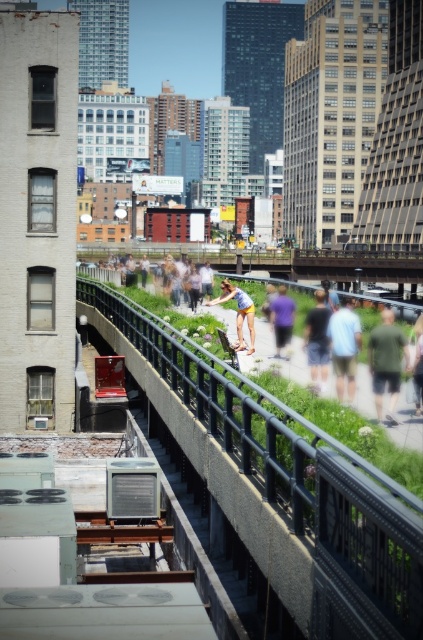
Question: Is green matte shirt at center thinner than dark gray shorts at center?

Choices:
 (A) yes
 (B) no

Answer: (A)

Question: Is green matte shirt at center below matte yellow shorts at center?

Choices:
 (A) yes
 (B) no

Answer: (A)

Question: Which object is the farthest from the purple cotton shirt at center?

Choices:
 (A) matte yellow shorts at center
 (B) matte white shorts at center
 (C) green grass at center

Answer: (C)

Question: Which object is closer to the camera taking this photo?

Choices:
 (A) green grass at center
 (B) matte yellow shorts at center

Answer: (B)

Question: Is dark gray shorts at center wider than purple cotton shirt at center?

Choices:
 (A) no
 (B) yes

Answer: (B)

Question: Which is nearer to the black metal rail at center?

Choices:
 (A) light blue shirt at center
 (B) matte white shorts at center

Answer: (B)